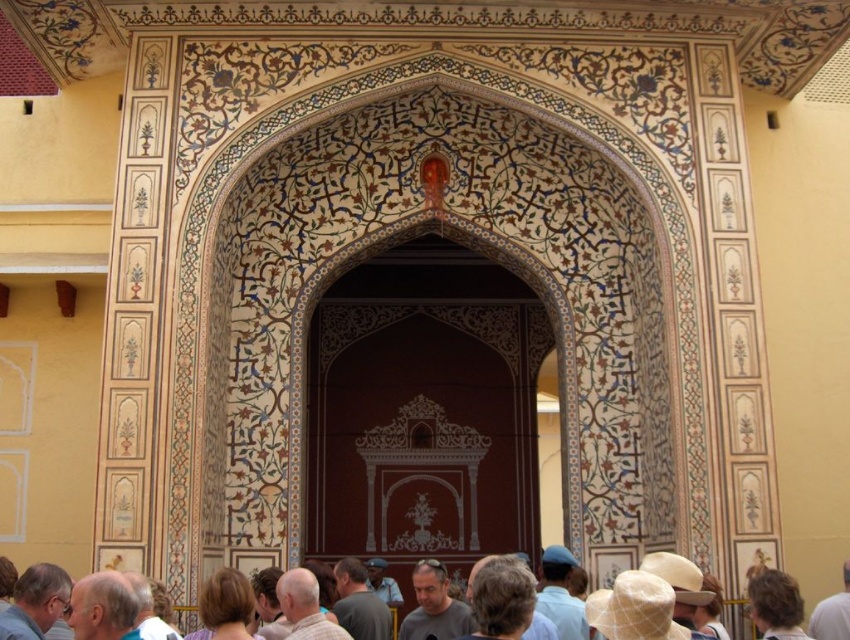
You are an artist observing the archway and notice two gray elements in the scene. One is the gray hair at lower left and the other is the gray fabric head at center. Which of these two elements is located above the other?

The gray hair at lower left is positioned over the gray fabric head at center, meaning it is above the fabric head.